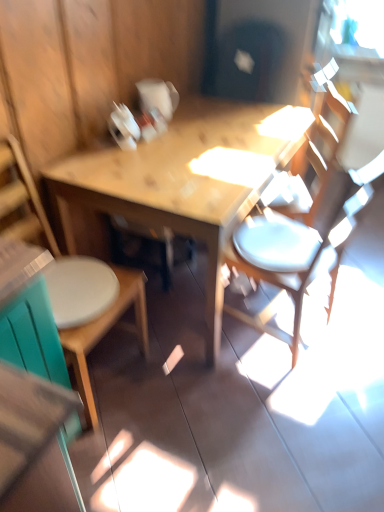
Where is `vacant location below white matte chair at right, which ranks as the 2th chair in left-to-right order (from a real-world perspective)`? The width and height of the screenshot is (384, 512). vacant location below white matte chair at right, which ranks as the 2th chair in left-to-right order (from a real-world perspective) is located at coordinates (274, 322).